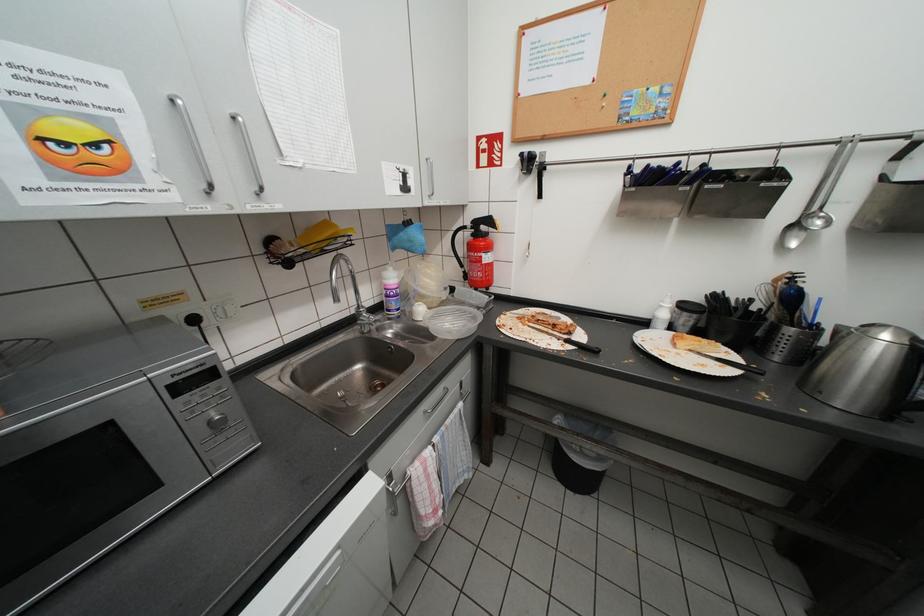
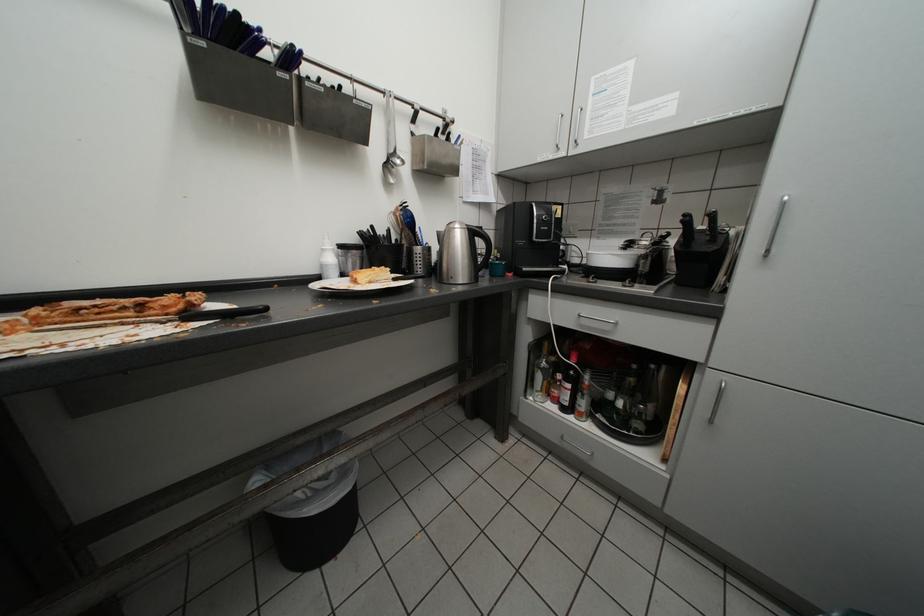
Question: How did the camera likely rotate?

Choices:
 (A) Left
 (B) Right
 (C) Up
 (D) Down

Answer: (B)